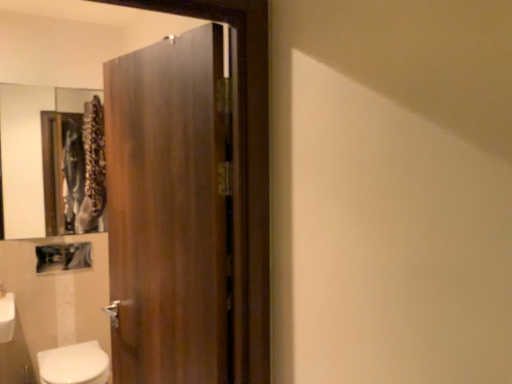
Question: Does wooden frame mirror at upper left appear on the right side of wooden door at center?

Choices:
 (A) no
 (B) yes

Answer: (A)

Question: Is wooden door at center located within wooden frame mirror at upper left?

Choices:
 (A) no
 (B) yes

Answer: (A)

Question: Can you confirm if wooden frame mirror at upper left is smaller than wooden door at center?

Choices:
 (A) yes
 (B) no

Answer: (A)

Question: Considering the relative sizes of wooden frame mirror at upper left and wooden door at center in the image provided, is wooden frame mirror at upper left thinner than wooden door at center?

Choices:
 (A) no
 (B) yes

Answer: (B)

Question: Can you confirm if wooden frame mirror at upper left is positioned to the left of wooden door at center?

Choices:
 (A) yes
 (B) no

Answer: (A)

Question: From the image's perspective, does wooden frame mirror at upper left appear lower than wooden door at center?

Choices:
 (A) yes
 (B) no

Answer: (B)

Question: Is wooden door at center wider than wooden frame mirror at upper left?

Choices:
 (A) no
 (B) yes

Answer: (B)

Question: From the image's perspective, does wooden door at center appear lower than wooden frame mirror at upper left?

Choices:
 (A) no
 (B) yes

Answer: (B)

Question: Does wooden door at center contain wooden frame mirror at upper left?

Choices:
 (A) yes
 (B) no

Answer: (B)

Question: Considering the relative sizes of wooden door at center and wooden frame mirror at upper left in the image provided, is wooden door at center thinner than wooden frame mirror at upper left?

Choices:
 (A) no
 (B) yes

Answer: (A)

Question: From a real-world perspective, is wooden door at center under wooden frame mirror at upper left?

Choices:
 (A) yes
 (B) no

Answer: (A)

Question: Considering the relative positions of wooden door at center and wooden frame mirror at upper left in the image provided, is wooden door at center to the right of wooden frame mirror at upper left from the viewer's perspective?

Choices:
 (A) no
 (B) yes

Answer: (B)

Question: Is white glossy bidet at lower left at the back of wooden door at center?

Choices:
 (A) no
 (B) yes

Answer: (A)